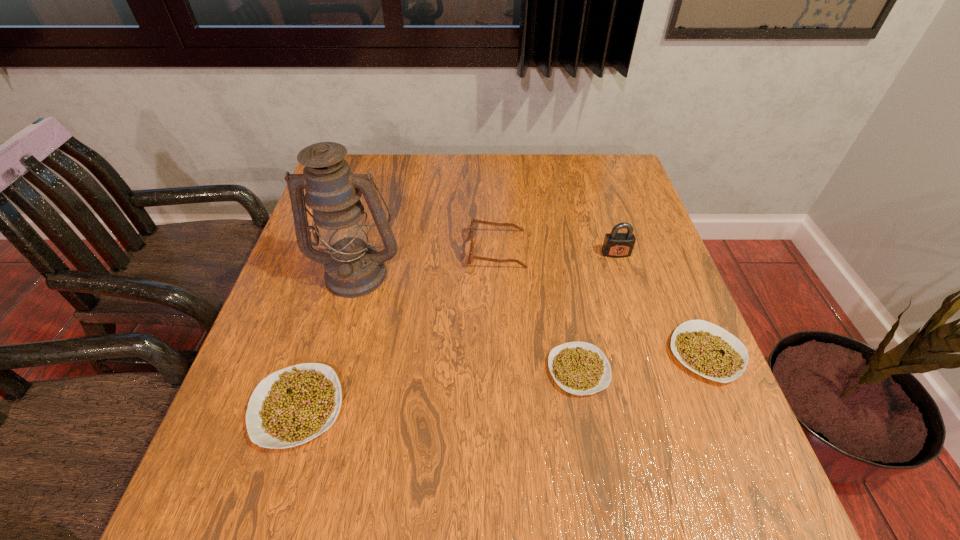
At what (x,y) coordinates should I click in order to perform the action: click on the leftmost legume. Please return your answer as a coordinate pair (x, y). Looking at the image, I should click on (292, 406).

Locate an element on the screen. The height and width of the screenshot is (540, 960). the shortest object is located at coordinates (580, 368).

I want to click on the shortest legume, so click(580, 368).

This screenshot has width=960, height=540. I want to click on the rightmost legume, so 710,351.

Locate an element on the screen. The image size is (960, 540). the second tallest legume is located at coordinates (710, 351).

Identify the location of the fifth shortest object. This screenshot has width=960, height=540. (616, 245).

At what (x,y) coordinates should I click in order to perform the action: click on padlock. Please return your answer as a coordinate pair (x, y). This screenshot has width=960, height=540. Looking at the image, I should click on (616, 245).

The height and width of the screenshot is (540, 960). Find the location of `the tallest object`. the tallest object is located at coordinates (353, 268).

Image resolution: width=960 pixels, height=540 pixels. What are the coordinates of `the third tallest object` in the screenshot? It's located at (473, 220).

This screenshot has height=540, width=960. In order to click on spectacles in this screenshot , I will do `click(473, 220)`.